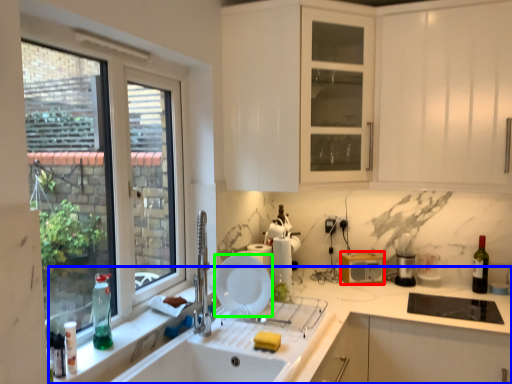
Question: Estimate the real-world distances between objects in this image. Which object is closer to appliance (highlighted by a red box), countertop (highlighted by a blue box) or plate (highlighted by a green box)?

Choices:
 (A) countertop
 (B) plate

Answer: (A)